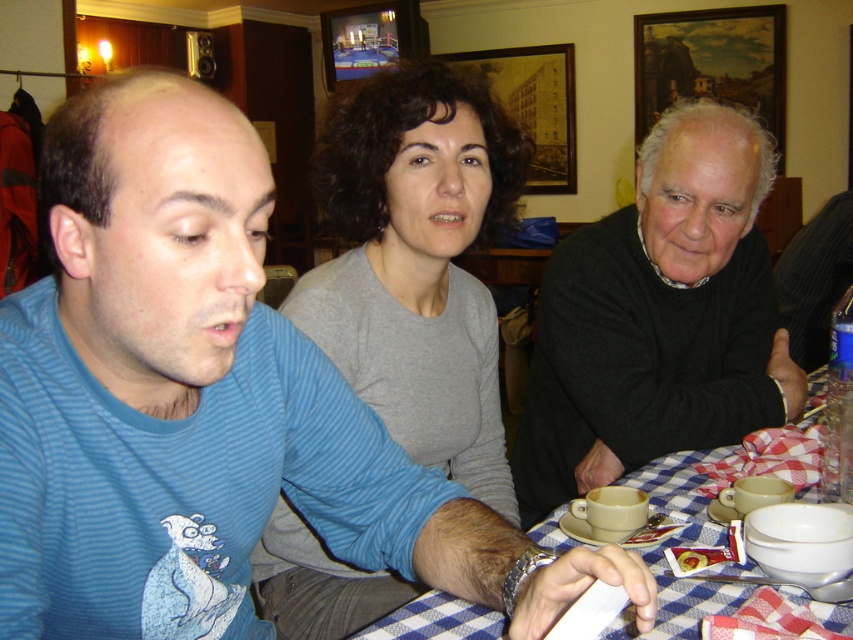
You are a waiter in a restaurant and need to place a drink order on the table. The table has a blue checkered tablecloth at lower center. Where should you place the order in relation to the gray matte shirt at center?

The gray matte shirt at center is above the blue checkered tablecloth at lower center, so you should place the drink order on the blue checkered tablecloth at lower center which is below the gray matte shirt at center.